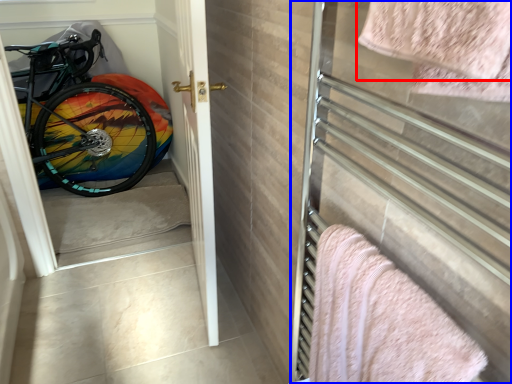
Question: Which object appears closest to the camera in this image, towel (highlighted by a red box) or screen door (highlighted by a blue box)?

Choices:
 (A) towel
 (B) screen door

Answer: (A)